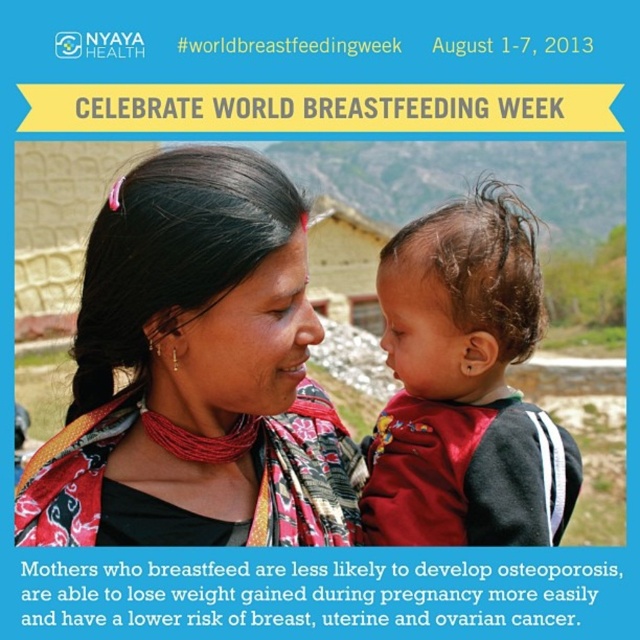
Question: Which of the following is the closest to the observer?

Choices:
 (A) (99, 465)
 (B) (518, 509)

Answer: (B)

Question: Can you confirm if multicolored fabric scarf at center is positioned above curly brown hair at center?

Choices:
 (A) yes
 (B) no

Answer: (B)

Question: Is multicolored fabric scarf at center to the left of curly brown hair at center from the viewer's perspective?

Choices:
 (A) no
 (B) yes

Answer: (B)

Question: Among these objects, which one is farthest from the camera?

Choices:
 (A) curly brown hair at center
 (B) multicolored fabric scarf at center

Answer: (A)

Question: Among these points, which one is farthest from the camera?

Choices:
 (A) (483, 266)
 (B) (216, 387)

Answer: (B)

Question: Can you confirm if multicolored fabric scarf at center is positioned to the left of curly brown hair at center?

Choices:
 (A) yes
 (B) no

Answer: (A)